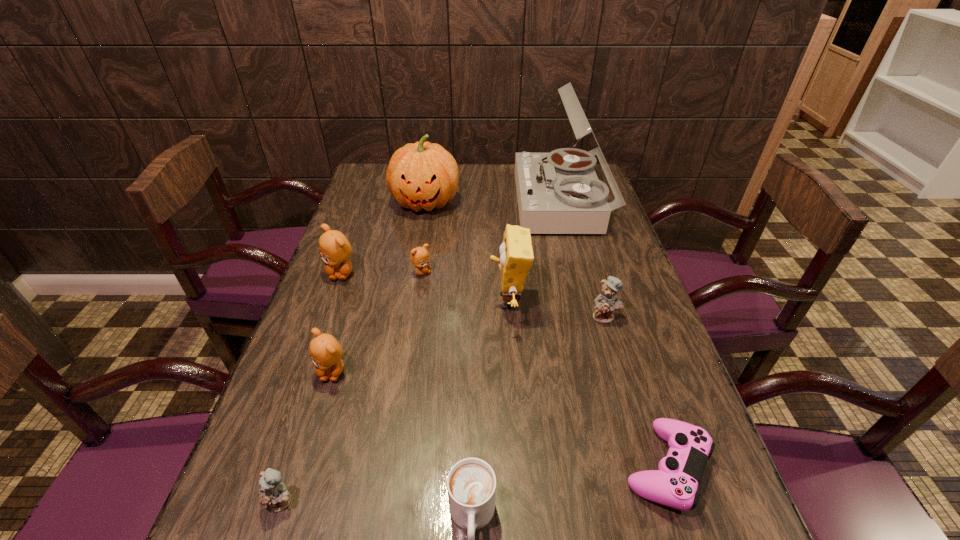
Locate which teddy bear is the third closest to the smaller blue teddy bear. Please provide its 2D coordinates. Your answer should be formatted as a tuple, i.e. [(x, y)], where the tuple contains the x and y coordinates of a point satisfying the conditions above.

[(419, 256)]

Where is `teddy bear that is the fourth closest to the cappuccino`? This screenshot has width=960, height=540. teddy bear that is the fourth closest to the cappuccino is located at coordinates (419, 256).

This screenshot has height=540, width=960. I want to click on brown teddy bear that is the closest to the pink control, so click(325, 351).

Identify which brown teddy bear is the third closest to the record player. Please provide its 2D coordinates. Your answer should be formatted as a tuple, i.e. [(x, y)], where the tuple contains the x and y coordinates of a point satisfying the conditions above.

[(325, 351)]

At what (x,y) coordinates should I click in order to perform the action: click on vacant area that satisfies the following two spatial constraints: 1. on the face of the sponge; 2. on the front-facing side of the smaller blue teddy bear. Please return your answer as a coordinate pair (x, y). Image resolution: width=960 pixels, height=540 pixels. Looking at the image, I should click on (522, 502).

Find the location of a particular element. free space that satisfies the following two spatial constraints: 1. on the carved face of the white record player; 2. on the right side of the ninth shortest object is located at coordinates (425, 203).